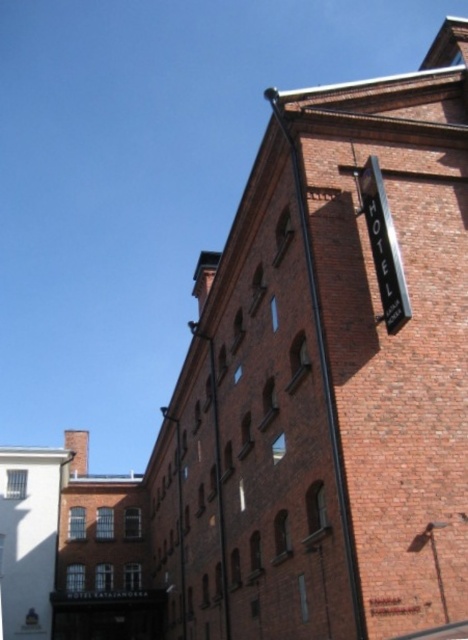
You are standing in front of the brick building and notice the metallic signboard at upper right and the smooth metal pole at center. From your perspective, which object is positioned to the right side?

The metallic signboard at upper right is positioned to the right of the smooth metal pole at center, so it is the one on the right side.

You are standing in front of the brick building and notice the metallic signboard at upper right and the smooth metal pole at center. Which object is taller?

The metallic signboard at upper right is much taller than the smooth metal pole at center.